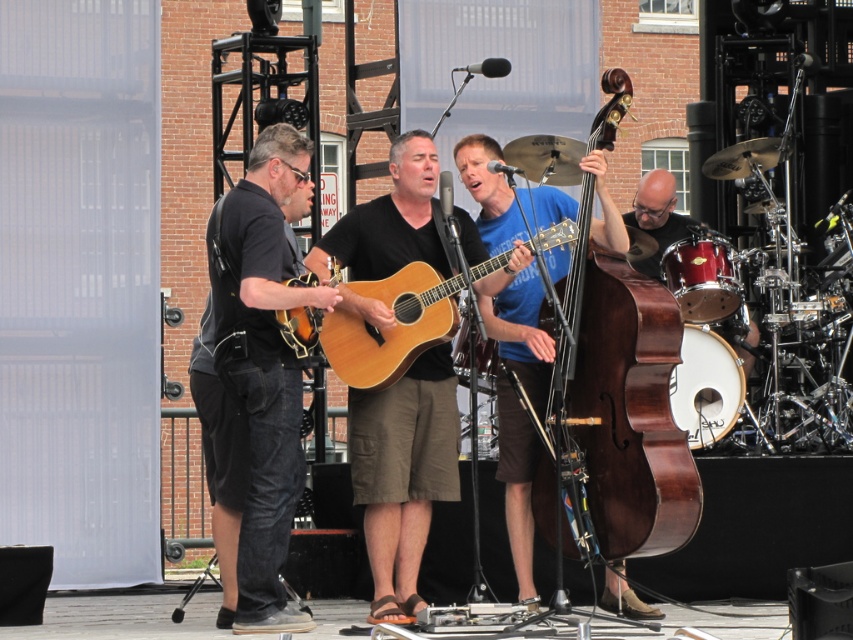
You are a photographer at the back of the stage. You want to take a picture of the denim jeans at left and the shiny black drum at right. Which object should you zoom in more on to capture details?

The denim jeans at left is smaller than the shiny black drum at right, so you should zoom in more on the denim jeans at left to capture its details.

You are a stagehand setting up a new microphone stand. The stand requires a space of 1 meter in width. You have to place it between the natural wood acoustic guitar at center and the shiny black drum at right. Is there enough space between them to accommodate the stand?

The natural wood acoustic guitar at center is wider than the shiny black drum at right. Since the guitar is wider, the total space between them might be sufficient for the 1 meter stand. However, without exact distance, it is hard to confirm. The description only compares their widths, not the space between them.

You are a photographer at the back of the stage. You want to take a photo of the natural wood acoustic guitar at center and the shiny black drum at right. From your position, which object is on the left side?

The natural wood acoustic guitar at center is positioned on the left side of the shiny black drum at right, so from your position at the back of the stage, the natural wood acoustic guitar at center is on the left side.